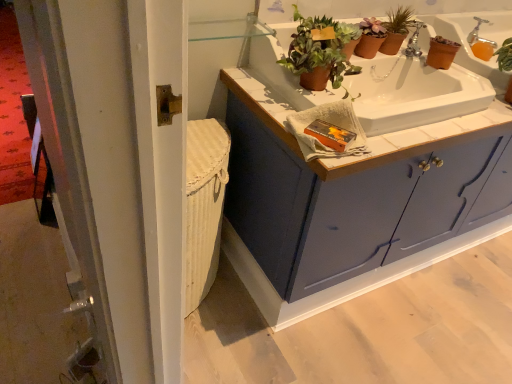
Question: In the image, is white tile countertop at upper center on the left side or the right side of terracotta clay pot at upper center, acting as the 2th houseplant starting from the back?

Choices:
 (A) left
 (B) right

Answer: (B)

Question: From the image's perspective, is white tile countertop at upper center located above or below terracotta clay pot at upper center, acting as the 2th houseplant starting from the back?

Choices:
 (A) above
 (B) below

Answer: (B)

Question: Which object is positioned farthest from the matte blue cabinet at center?

Choices:
 (A) silver metallic faucet at upper right
 (B) white tile countertop at upper center
 (C) terracotta clay pot at upper center, arranged as the 1th houseplant when viewed from the front
 (D) terracotta clay pot at upper center, the second houseplant when ordered from left to right

Answer: (A)

Question: Estimate the real-world distances between objects in this image. Which object is farther from the silver metallic faucet at upper right?

Choices:
 (A) terracotta clay pot at upper center, the second houseplant when ordered from front to back
 (B) matte blue cabinet at center
 (C) terracotta clay pot at upper center, which appears as the second houseplant when viewed from the right
 (D) white tile countertop at upper center

Answer: (B)